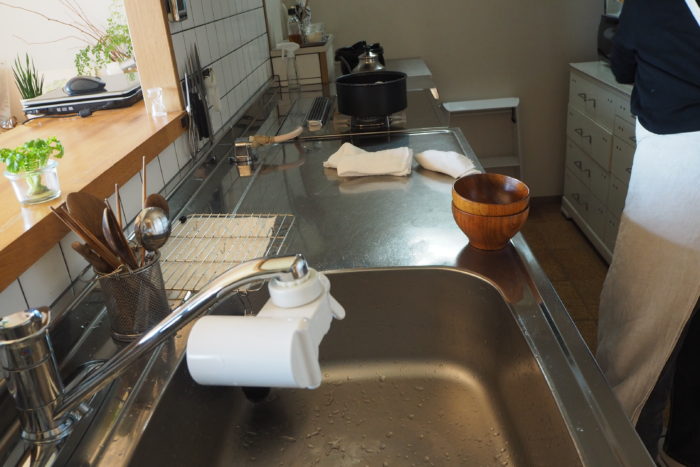
The image size is (700, 467). I want to click on cooking utensils, so click(x=122, y=238), click(x=190, y=85).